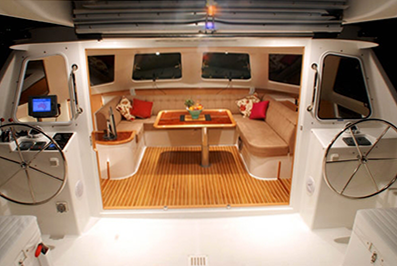
You are a GUI agent. You are given a task and a screenshot of the screen. Output one action in this format:
    pyautogui.click(x=<x>, y=<y>)
    Task: Click on the green bowl
    This screenshot has width=397, height=266.
    Given the screenshot: What is the action you would take?
    pyautogui.click(x=195, y=113)